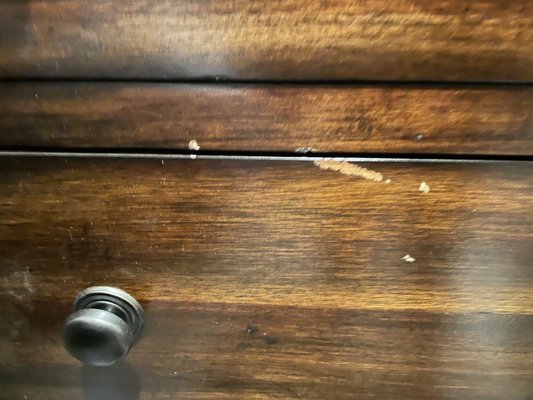
This screenshot has height=400, width=533. Find the location of `shadow from door knob`. shadow from door knob is located at coordinates (103, 374).